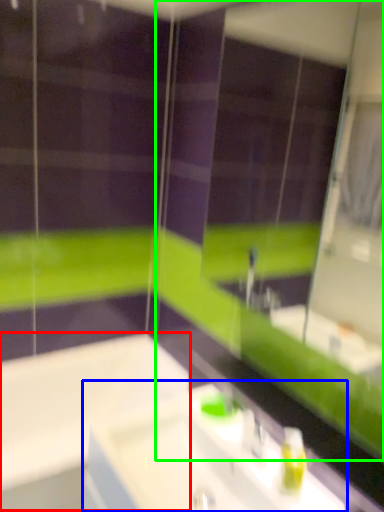
Question: Which object is positioned closest to bath (highlighted by a red box)? Select from sink (highlighted by a blue box) and mirror (highlighted by a green box).

Choices:
 (A) sink
 (B) mirror

Answer: (A)